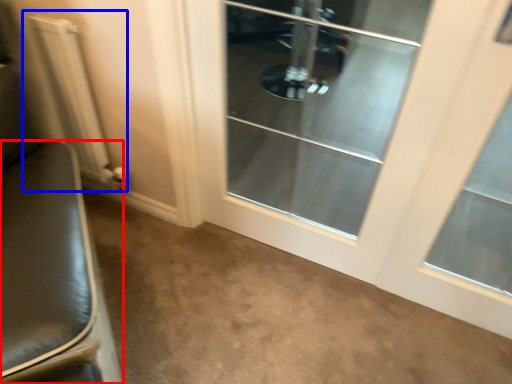
Question: Which object is further to the camera taking this photo, furniture (highlighted by a red box) or radiator (highlighted by a blue box)?

Choices:
 (A) furniture
 (B) radiator

Answer: (B)